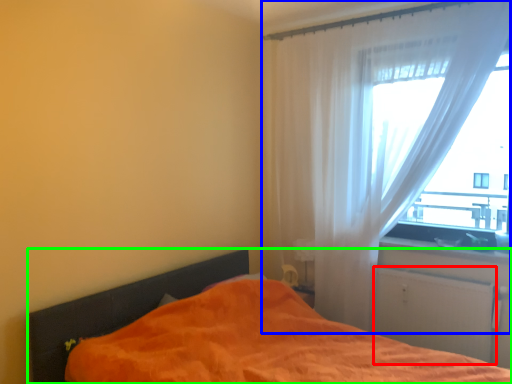
Question: Which is farther away from screen door (highlighted by a red box)? curtain (highlighted by a blue box) or bed (highlighted by a green box)?

Choices:
 (A) curtain
 (B) bed

Answer: (B)